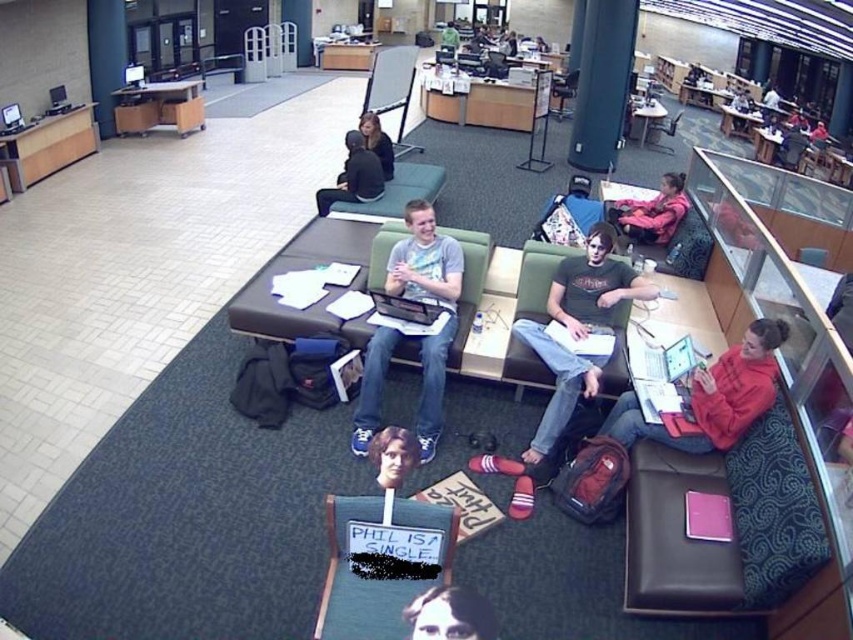
You are standing at point (392, 154) and want to move to the entrance located at point (352, 138). Is the entrance directly in front of you?

Yes, the entrance at point (352, 138) is directly in front of you because it is positioned in front of your current location at point (392, 154).

Based on the photo, you are organizing a small event in this library and need to place a 1.5 meter long table between the wooden chair at lower center and the dark hair at upper center. Can the table fit in the space between them?

The wooden chair at lower center has a smaller size compared to dark hair at upper center, but the description does not provide the distance between them. Therefore, it is unclear if the 1.5 meter table can fit in the space between them.

Consider the image. You are a photographer trying to capture a candid shot of the person wearing the dark gray sweater at center and the individual with dark hair at upper center. Given that your camera has a focal length of 50mm and a sensor size of 24x36mm, can you estimate whether the two subjects are positioned close enough to be captured in a single frame without moving the camera? Please consider their distance apart and the field of view of your camera setup.

The dark gray sweater at center is 10.68 inches from dark hair at upper center. With a 50mm lens and a 24x36mm sensor, the horizontal field of view at this focal length is approximately 39 degrees, translating to roughly 43 inches at a typical shooting distance. Since the subjects are only 10.68 inches apart, they can comfortably fit within the frame without needing to reposition the camera.